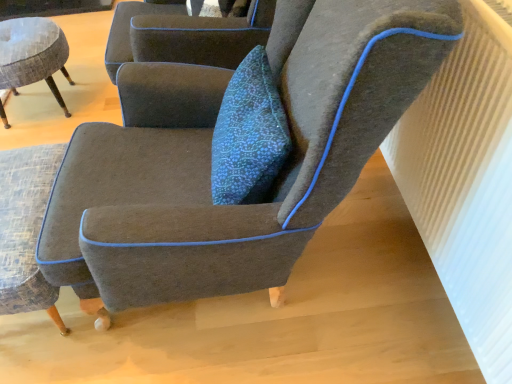
Question: Is textured gray stool at left, the 1th chair viewed from the left, facing away from white ribbed radiator at upper right?

Choices:
 (A) no
 (B) yes

Answer: (A)

Question: From a real-world perspective, is textured gray stool at left, the 3th chair when ordered from right to left, below white ribbed radiator at upper right?

Choices:
 (A) no
 (B) yes

Answer: (B)

Question: Considering the relative positions of textured gray stool at left, the 1th chair viewed from the left, and white ribbed radiator at upper right in the image provided, is textured gray stool at left, the 1th chair viewed from the left, to the right of white ribbed radiator at upper right from the viewer's perspective?

Choices:
 (A) no
 (B) yes

Answer: (A)

Question: From the image's perspective, does textured gray stool at left, the 1th chair viewed from the left, appear lower than white ribbed radiator at upper right?

Choices:
 (A) yes
 (B) no

Answer: (B)

Question: Considering the relative sizes of textured gray stool at left, the 3th chair when ordered from right to left, and white ribbed radiator at upper right in the image provided, is textured gray stool at left, the 3th chair when ordered from right to left, wider than white ribbed radiator at upper right?

Choices:
 (A) no
 (B) yes

Answer: (B)

Question: Based on their sizes in the image, would you say white ribbed radiator at upper right is bigger or smaller than textured gray armchair at lower left, positioned as the second chair in left-to-right order?

Choices:
 (A) big
 (B) small

Answer: (A)

Question: Do you think white ribbed radiator at upper right is within textured gray armchair at lower left, the second chair when ordered from right to left, or outside of it?

Choices:
 (A) inside
 (B) outside

Answer: (B)

Question: Considering the positions of white ribbed radiator at upper right and textured gray armchair at lower left, positioned as the second chair in left-to-right order, in the image, is white ribbed radiator at upper right taller or shorter than textured gray armchair at lower left, positioned as the second chair in left-to-right order,?

Choices:
 (A) short
 (B) tall

Answer: (B)

Question: Considering their positions, is white ribbed radiator at upper right located in front of or behind textured gray armchair at lower left, positioned as the second chair in left-to-right order?

Choices:
 (A) behind
 (B) front

Answer: (B)

Question: From a real-world perspective, relative to textured gray armchair at lower left, positioned as the second chair in left-to-right order, is dark gray fabric chair at center, the 3th chair when ordered from left to right, vertically above or below?

Choices:
 (A) above
 (B) below

Answer: (A)

Question: Considering the positions of dark gray fabric chair at center, the 3th chair when ordered from left to right, and textured gray armchair at lower left, the second chair when ordered from right to left, in the image, is dark gray fabric chair at center, the 3th chair when ordered from left to right, wider or thinner than textured gray armchair at lower left, the second chair when ordered from right to left,?

Choices:
 (A) wide
 (B) thin

Answer: (A)

Question: From the image's perspective, is dark gray fabric chair at center, which is the 1th chair in right-to-left order, located above or below textured gray armchair at lower left, the second chair when ordered from right to left?

Choices:
 (A) above
 (B) below

Answer: (A)

Question: Is point (352, 162) positioned closer to the camera than point (45, 281)?

Choices:
 (A) closer
 (B) farther

Answer: (A)

Question: In the image, is textured gray armchair at lower left, the second chair when ordered from right to left, positioned in front of or behind textured gray stool at left, the 1th chair viewed from the left?

Choices:
 (A) front
 (B) behind

Answer: (A)

Question: Looking at the image, does textured gray armchair at lower left, positioned as the second chair in left-to-right order, seem bigger or smaller compared to textured gray stool at left, the 1th chair viewed from the left?

Choices:
 (A) small
 (B) big

Answer: (A)